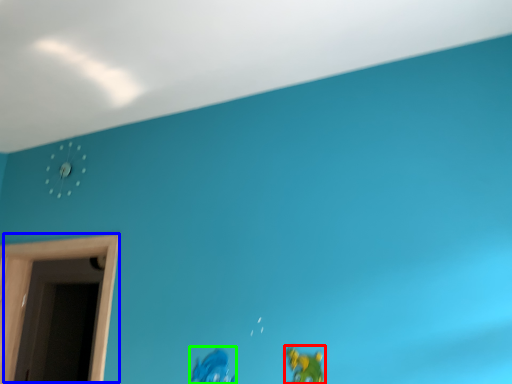
Question: Estimate the real-world distances between objects in this image. Which object is farther from toy (highlighted by a red box), window (highlighted by a blue box) or toy (highlighted by a green box)?

Choices:
 (A) window
 (B) toy

Answer: (A)